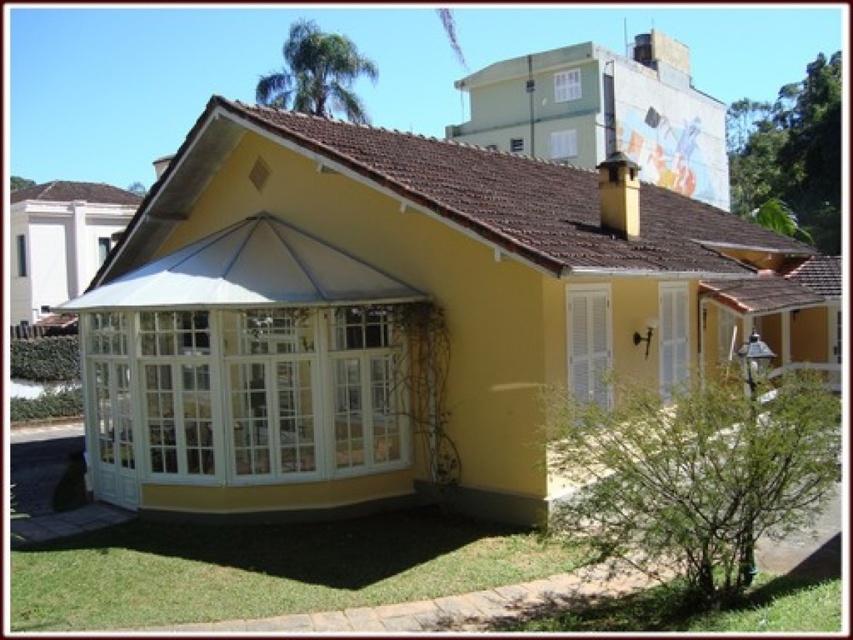
Locate an element on the screen. white glass gazebo at center is located at coordinates (242, 365).

Is white glass conservatory at center bigger than white fabric canopy at center?

Indeed, white glass conservatory at center has a larger size compared to white fabric canopy at center.

Who is more distant from viewer, (502, 230) or (283, 262)?

The point (283, 262) is behind.

Is point (546, 209) positioned after point (170, 266)?

That is True.

At what (x,y) coordinates should I click in order to perform the action: click on white glass conservatory at center. Please return your answer as a coordinate pair (x, y). The height and width of the screenshot is (640, 853). Looking at the image, I should click on (401, 314).

The width and height of the screenshot is (853, 640). Identify the location of white glass conservatory at center. (401, 314).

Does point (666, 362) lie in front of point (337, 470)?

No, (666, 362) is behind (337, 470).

Where is `white glass conservatory at center`? white glass conservatory at center is located at coordinates (401, 314).

Where is `white glass conservatory at center`? The image size is (853, 640). white glass conservatory at center is located at coordinates (x=401, y=314).